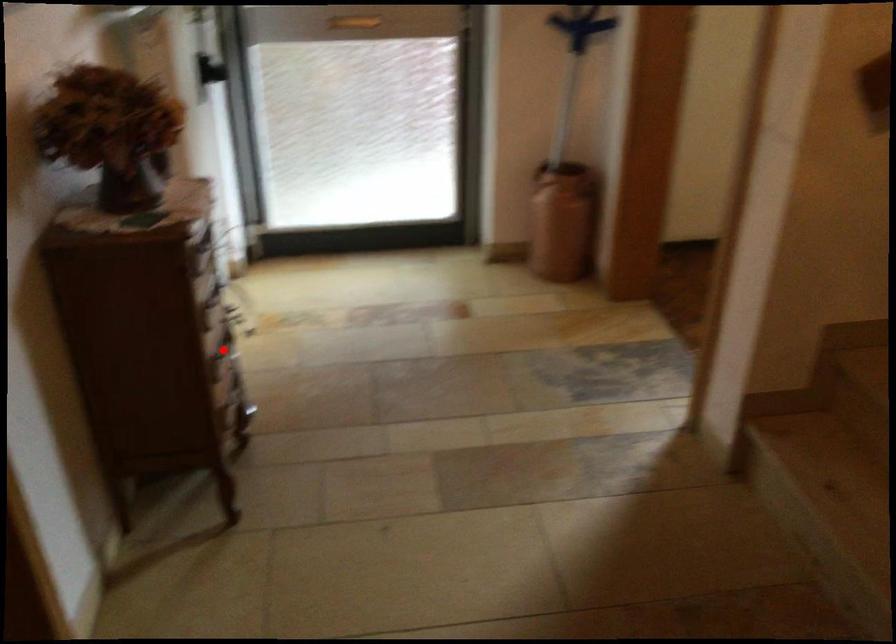
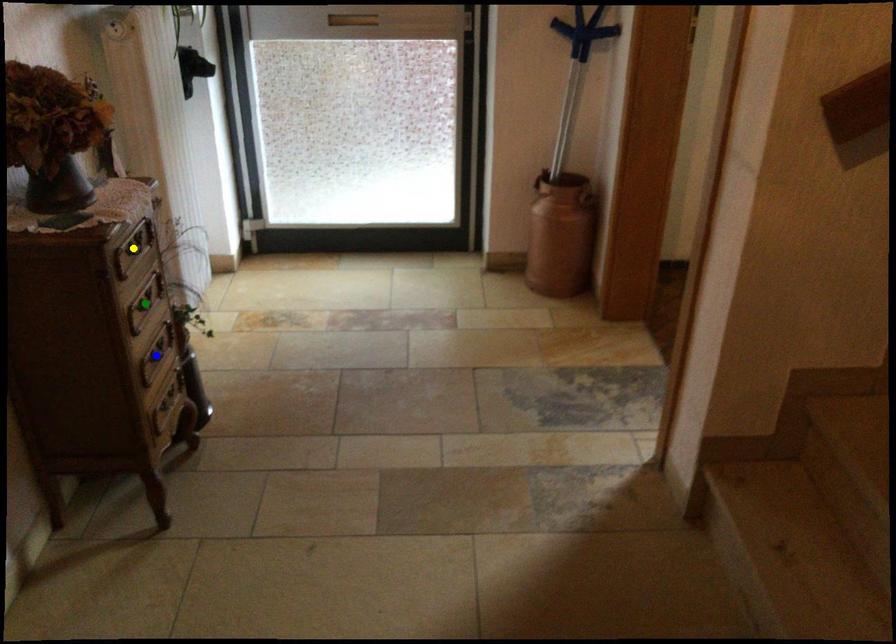
Question: I am providing you with two images of the same scene from different viewpoints. A red point is marked on the first image. You are given multiple points on the second image. Which mark in image 2 goes with the point in image 1?

Choices:
 (A) yellow point
 (B) green point
 (C) blue point

Answer: (C)